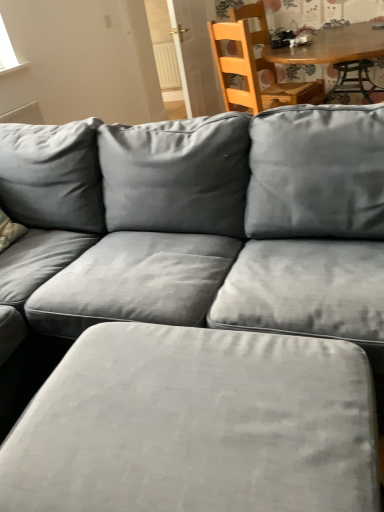
Describe the element at coordinates (197, 425) in the screenshot. I see `suede gray ottoman at lower center` at that location.

The height and width of the screenshot is (512, 384). What do you see at coordinates (333, 46) in the screenshot? I see `wooden table at upper center` at bounding box center [333, 46].

The height and width of the screenshot is (512, 384). Describe the element at coordinates (167, 66) in the screenshot. I see `white plastic radiator at upper center` at that location.

Locate an element on the screen. white plastic radiator at upper center is located at coordinates (167, 66).

In order to face wooden chair at upper right, should I rotate leftwards or rightwards?

Turn right approximately 11.872 degrees to face it.

The width and height of the screenshot is (384, 512). I want to click on wooden chair at upper right, so click(287, 88).

Where is `suede gray ottoman at lower center`? The image size is (384, 512). suede gray ottoman at lower center is located at coordinates (197, 425).

Considering the relative positions of wooden table at upper center and wooden chair at upper right in the image provided, is wooden table at upper center to the left or to the right of wooden chair at upper right?

Clearly, wooden table at upper center is on the right of wooden chair at upper right in the image.

Is wooden chair at upper right a part of wooden table at upper center?

That's correct, wooden chair at upper right is inside wooden table at upper center.

Looking at this image, what's the angular difference between wooden table at upper center and wooden chair at upper right's facing directions?

The angle between the facing direction of wooden table at upper center and the facing direction of wooden chair at upper right is 68.3 degrees.

Which object is positioned more to the right, suede gray ottoman at lower center or wooden chair at upper right?

Positioned to the right is wooden chair at upper right.

Is wooden chair at upper right inside suede gray ottoman at lower center?

Definitely not — wooden chair at upper right is not inside suede gray ottoman at lower center.

Looking at this image, are suede gray ottoman at lower center and wooden chair at upper right beside each other?

No, suede gray ottoman at lower center is not making contact with wooden chair at upper right.

Can you tell me how much suede gray ottoman at lower center and wooden chair at upper right differ in facing direction?

The angle between the facing direction of suede gray ottoman at lower center and the facing direction of wooden chair at upper right is 65.4 degrees.

Who is bigger, wooden table at upper center or suede gray ottoman at lower center?

wooden table at upper center.

Is wooden table at upper center positioned far away from suede gray ottoman at lower center?

Yes, wooden table at upper center and suede gray ottoman at lower center are located far from each other.

Can suede gray ottoman at lower center be found inside wooden table at upper center?

That's incorrect, suede gray ottoman at lower center is not inside wooden table at upper center.

Considering the positions of point (346, 42) and point (238, 365), is point (346, 42) closer or farther from the camera than point (238, 365)?

Point (346, 42) is positioned farther from the camera compared to point (238, 365).

How distant is white plastic radiator at upper center from wooden table at upper center?

white plastic radiator at upper center and wooden table at upper center are 2.68 meters apart.

Does white plastic radiator at upper center come behind wooden table at upper center?

Yes, the depth of white plastic radiator at upper center is greater than that of wooden table at upper center.

Does white plastic radiator at upper center have a lesser height compared to wooden table at upper center?

Indeed, white plastic radiator at upper center has a lesser height compared to wooden table at upper center.

Is white plastic radiator at upper center far away from wooden table at upper center?

Yes.

Considering the relative sizes of white plastic radiator at upper center and suede gray ottoman at lower center in the image provided, is white plastic radiator at upper center smaller than suede gray ottoman at lower center?

Yes.

Based on the photo, from the image's perspective, is white plastic radiator at upper center above suede gray ottoman at lower center?

Correct, white plastic radiator at upper center appears higher than suede gray ottoman at lower center in the image.

Considering the relative sizes of white plastic radiator at upper center and suede gray ottoman at lower center in the image provided, is white plastic radiator at upper center wider than suede gray ottoman at lower center?

No, white plastic radiator at upper center is not wider than suede gray ottoman at lower center.

Consider the image. What's the angular difference between wooden chair at upper right and suede gray ottoman at lower center's facing directions?

They differ by 65.4 degrees in their facing directions.

Would you say wooden chair at upper right is outside suede gray ottoman at lower center?

wooden chair at upper right lies outside suede gray ottoman at lower center's area.

Does wooden chair at upper right have a larger size compared to suede gray ottoman at lower center?

No, wooden chair at upper right is not bigger than suede gray ottoman at lower center.

Is wooden chair at upper right positioned far away from suede gray ottoman at lower center?

Yes, wooden chair at upper right is far from suede gray ottoman at lower center.

Is wooden chair at upper right oriented away from wooden table at upper center?

Yes, wooden chair at upper right's orientation is away from wooden table at upper center.

From a real-world perspective, is wooden chair at upper right located higher than wooden table at upper center?

Yes.

Between wooden chair at upper right and wooden table at upper center, which one has less height?

wooden table at upper center is shorter.

Is wooden chair at upper right thinner than wooden table at upper center?

Correct, the width of wooden chair at upper right is less than that of wooden table at upper center.

In order to click on chair that appears above the wooden table at upper center (from a real-world perspective) in this screenshot , I will do `click(287, 88)`.

Identify the location of swivel chair located underneath the wooden chair at upper right (from a real-world perspective). (197, 425).

Estimate the real-world distances between objects in this image. Which object is closer to suede gray ottoman at lower center, wooden chair at upper right or wooden table at upper center?

wooden table at upper center is positioned closer to the anchor suede gray ottoman at lower center.

From the picture: Looking at the image, which one is located closer to white plastic radiator at upper center, wooden table at upper center or wooden chair at upper right?

Among the two, wooden chair at upper right is located nearer to white plastic radiator at upper center.

From the image, which object appears to be farther from wooden chair at upper right, wooden table at upper center or white plastic radiator at upper center?

Based on the image, white plastic radiator at upper center appears to be further to wooden chair at upper right.

When comparing their distances from suede gray ottoman at lower center, does wooden table at upper center or wooden chair at upper right seem further?

Based on the image, wooden chair at upper right appears to be further to suede gray ottoman at lower center.

Looking at the image, which one is located closer to suede gray ottoman at lower center, wooden chair at upper right or white plastic radiator at upper center?

wooden chair at upper right is positioned closer to the anchor suede gray ottoman at lower center.

From the image, which object appears to be farther from wooden chair at upper right, white plastic radiator at upper center or wooden table at upper center?

Among the two, white plastic radiator at upper center is located further to wooden chair at upper right.

Considering their positions, is suede gray ottoman at lower center positioned closer to wooden table at upper center than white plastic radiator at upper center?

Based on the image, suede gray ottoman at lower center appears to be nearer to wooden table at upper center.

Looking at the image, which one is located closer to wooden table at upper center, suede gray ottoman at lower center or wooden chair at upper right?

wooden chair at upper right is closer to wooden table at upper center.

Where is `chair between suede gray ottoman at lower center and white plastic radiator at upper center from front to back`? The width and height of the screenshot is (384, 512). chair between suede gray ottoman at lower center and white plastic radiator at upper center from front to back is located at coordinates (287, 88).

Image resolution: width=384 pixels, height=512 pixels. Identify the location of table located between suede gray ottoman at lower center and wooden chair at upper right in the depth direction. (333, 46).

I want to click on table positioned between suede gray ottoman at lower center and white plastic radiator at upper center from near to far, so click(333, 46).

Where is `chair positioned between wooden table at upper center and white plastic radiator at upper center from near to far`? chair positioned between wooden table at upper center and white plastic radiator at upper center from near to far is located at coordinates (287, 88).